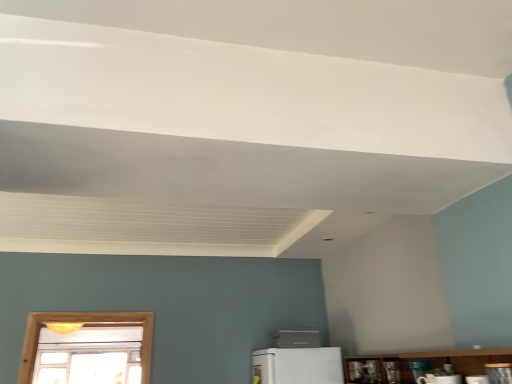
Question: Does white plastic air conditioner at center, which is the first appliance from left to right, turn towards metallic silver toaster at lower right, marked as the 1th appliance in a right-to-left arrangement?

Choices:
 (A) yes
 (B) no

Answer: (B)

Question: Can you confirm if white plastic air conditioner at center, the 4th appliance in the top-to-bottom sequence, is thinner than metallic silver toaster at lower right, which appears as the second appliance when viewed from the back?

Choices:
 (A) yes
 (B) no

Answer: (B)

Question: From the image's perspective, is white plastic air conditioner at center, the first appliance from the bottom, located beneath metallic silver toaster at lower right, arranged as the 3th appliance when viewed from the front?

Choices:
 (A) no
 (B) yes

Answer: (B)

Question: Considering the relative sizes of white plastic air conditioner at center, the 4th appliance in the top-to-bottom sequence, and metallic silver toaster at lower right, the fourth appliance when ordered from left to right, in the image provided, is white plastic air conditioner at center, the 4th appliance in the top-to-bottom sequence, shorter than metallic silver toaster at lower right, the fourth appliance when ordered from left to right,?

Choices:
 (A) yes
 (B) no

Answer: (B)

Question: Are white plastic air conditioner at center, which ranks as the 4th appliance in front-to-back order, and metallic silver toaster at lower right, which appears as the second appliance when viewed from the back, located far from each other?

Choices:
 (A) yes
 (B) no

Answer: (A)

Question: Does white plastic air conditioner at center, the fourth appliance in the right-to-left sequence, have a greater height compared to metallic silver toaster at lower right, the fourth appliance when ordered from left to right?

Choices:
 (A) no
 (B) yes

Answer: (B)

Question: From a real-world perspective, is wooden at lower right beneath white plastic air conditioner at center, which appears as the 1th appliance when viewed from the back?

Choices:
 (A) no
 (B) yes

Answer: (B)

Question: Considering the relative sizes of wooden at lower right and white plastic air conditioner at center, which appears as the 1th appliance when viewed from the back, in the image provided, is wooden at lower right smaller than white plastic air conditioner at center, which appears as the 1th appliance when viewed from the back,?

Choices:
 (A) no
 (B) yes

Answer: (A)

Question: Is wooden at lower right far away from white plastic air conditioner at center, the 4th appliance in the top-to-bottom sequence?

Choices:
 (A) no
 (B) yes

Answer: (A)

Question: From the image's perspective, is wooden at lower right on white plastic air conditioner at center, the first appliance from the bottom?

Choices:
 (A) yes
 (B) no

Answer: (A)

Question: Is wooden at lower right taller than white plastic air conditioner at center, the first appliance from the bottom?

Choices:
 (A) yes
 (B) no

Answer: (A)

Question: Can you confirm if wooden at lower right is wider than white plastic air conditioner at center, the first appliance from the bottom?

Choices:
 (A) yes
 (B) no

Answer: (A)

Question: Is white plastic air conditioner at center, which appears as the 1th appliance when viewed from the back, positioned before white glossy microwave at lower center, which is the third appliance in back-to-front order?

Choices:
 (A) yes
 (B) no

Answer: (B)